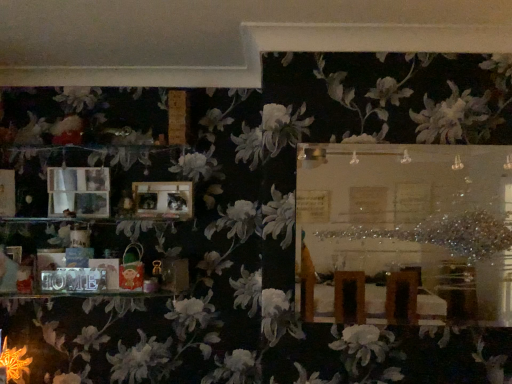
Question: Is matte plastic bag at lower left positioned beyond the bounds of wooden frame at upper center?

Choices:
 (A) no
 (B) yes

Answer: (B)

Question: Is matte plastic bag at lower left smaller than wooden frame at upper center?

Choices:
 (A) no
 (B) yes

Answer: (B)

Question: Is matte plastic bag at lower left far from wooden frame at upper center?

Choices:
 (A) yes
 (B) no

Answer: (B)

Question: Considering the relative sizes of matte plastic bag at lower left and wooden frame at upper center in the image provided, is matte plastic bag at lower left thinner than wooden frame at upper center?

Choices:
 (A) yes
 (B) no

Answer: (B)

Question: Is matte plastic bag at lower left oriented away from wooden frame at upper center?

Choices:
 (A) yes
 (B) no

Answer: (B)

Question: From the image's perspective, is matte plastic bag at lower left above or below wooden photo frame at center, the first picture frame when ordered from right to left?

Choices:
 (A) below
 (B) above

Answer: (A)

Question: From a real-world perspective, is matte plastic bag at lower left positioned above or below wooden photo frame at center, the second picture frame positioned from the left?

Choices:
 (A) above
 (B) below

Answer: (B)

Question: Is matte plastic bag at lower left situated inside wooden photo frame at center, the second picture frame positioned from the left, or outside?

Choices:
 (A) inside
 (B) outside

Answer: (B)

Question: Considering the positions of matte plastic bag at lower left and wooden photo frame at center, the second picture frame positioned from the left, in the image, is matte plastic bag at lower left taller or shorter than wooden photo frame at center, the second picture frame positioned from the left,?

Choices:
 (A) tall
 (B) short

Answer: (A)

Question: Is wooden frame at upper center spatially inside orange textured flower at lower left, or outside of it?

Choices:
 (A) inside
 (B) outside

Answer: (B)

Question: From a real-world perspective, is wooden frame at upper center above or below orange textured flower at lower left?

Choices:
 (A) below
 (B) above

Answer: (B)

Question: Looking at their shapes, would you say wooden frame at upper center is wider or thinner than orange textured flower at lower left?

Choices:
 (A) thin
 (B) wide

Answer: (A)

Question: From the image's perspective, is wooden frame at upper center above or below orange textured flower at lower left?

Choices:
 (A) above
 (B) below

Answer: (A)

Question: Considering the positions of matte wooden picture frame at left, the 1th picture frame from the left, and wooden photo frame at center, the second picture frame positioned from the left, in the image, is matte wooden picture frame at left, the 1th picture frame from the left, bigger or smaller than wooden photo frame at center, the second picture frame positioned from the left,?

Choices:
 (A) small
 (B) big

Answer: (B)

Question: From the image's perspective, is matte wooden picture frame at left, which is the second picture frame from right to left, positioned above or below wooden photo frame at center, the first picture frame when ordered from right to left?

Choices:
 (A) above
 (B) below

Answer: (A)